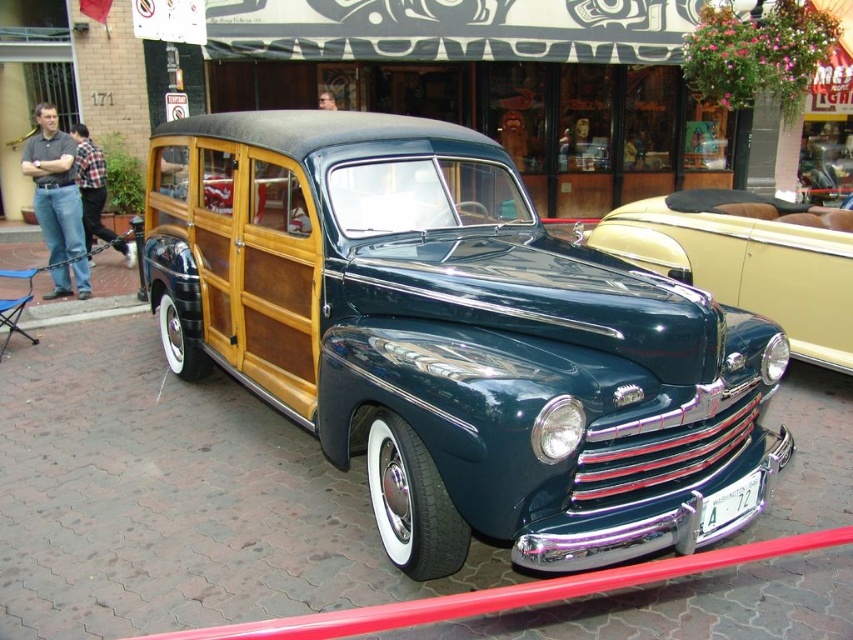
You are a photographer standing in front of the vintage Ford car. You want to take a photo that includes both the point at coordinates point [161,209] and point [846,301]. Which point should be closer to the camera in your photo?

Point [161,209] is further to the camera than point [846,301], so in the photo, point [161,209] will be closer to the camera than point [846,301].

Based on the photo, you are a photographer trying to capture the shiny dark green wood paneling car at center and the shiny dark green wood paneling at center in a single shot. Which object should you position closer to the camera to ensure both are in focus?

The shiny dark green wood paneling car at center is positioned on the left side of the shiny dark green wood paneling at center. To ensure both are in focus, you should position the camera so that both objects are within the same focal plane. Since they are side by side, adjusting the camera angle to include both without moving closer to one would be ideal.